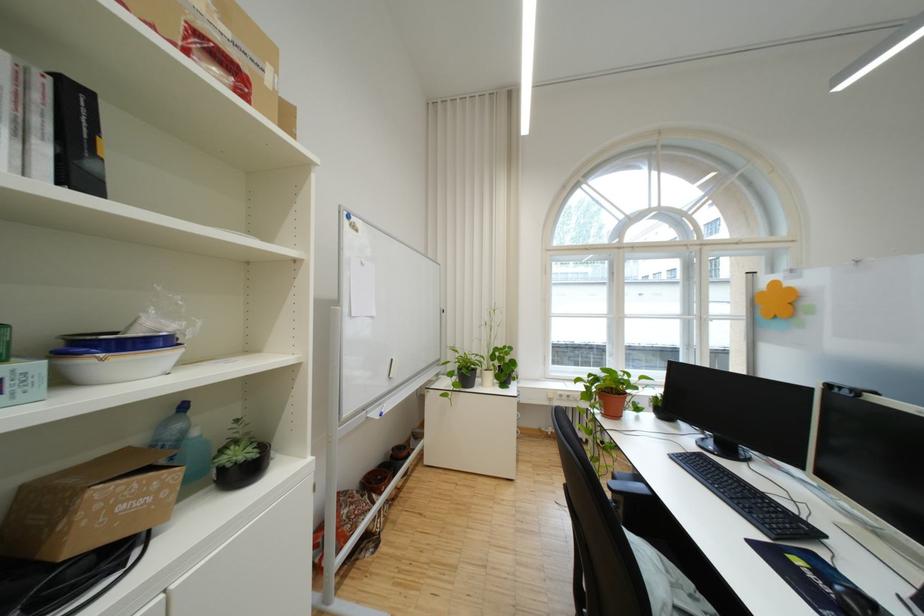
This screenshot has height=616, width=924. What are the coordinates of `chair sitting surface` in the screenshot? It's located at (681, 581).